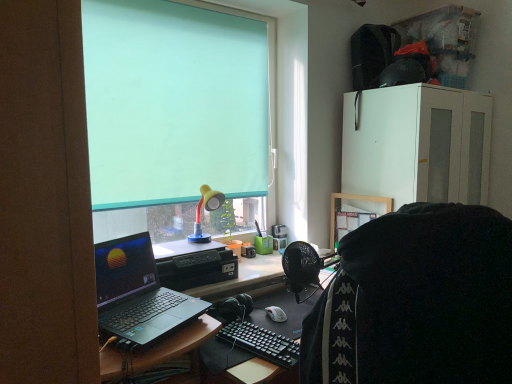
Question: Is teal matte/soft roller blind at upper center taller or shorter than yellow matte lamp at upper center?

Choices:
 (A) short
 (B) tall

Answer: (B)

Question: In the image, is teal matte/soft roller blind at upper center on the left side or the right side of yellow matte lamp at upper center?

Choices:
 (A) right
 (B) left

Answer: (B)

Question: Which is farther from the silver metallic laptop at left?

Choices:
 (A) teal matte/soft roller blind at upper center
 (B) yellow matte lamp at upper center
 (C) white matte cabinet at upper right
 (D) black fabric at center

Answer: (C)

Question: Which is nearer to the yellow matte lamp at upper center?

Choices:
 (A) black fabric at center
 (B) teal matte/soft roller blind at upper center
 (C) silver metallic laptop at left
 (D) white matte cabinet at upper right

Answer: (B)